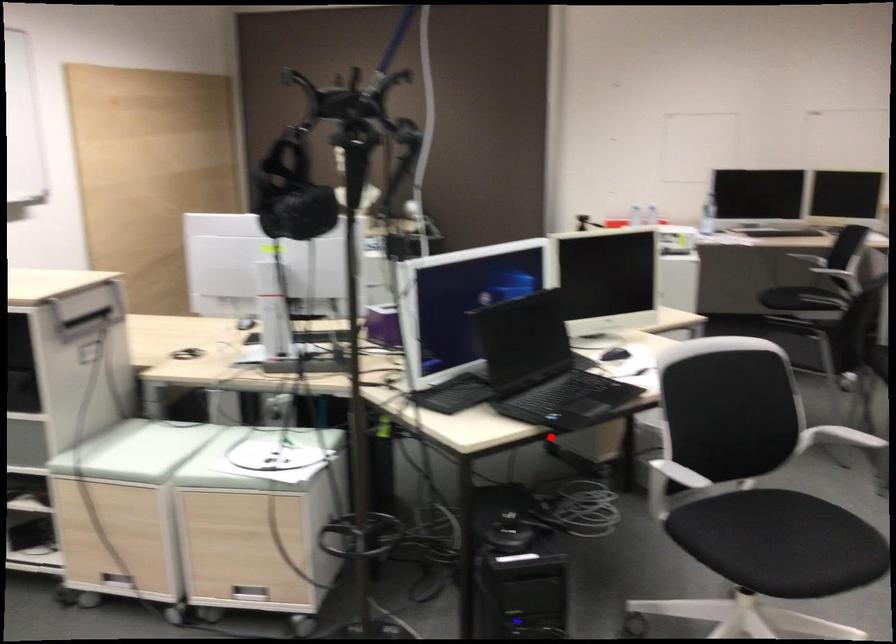
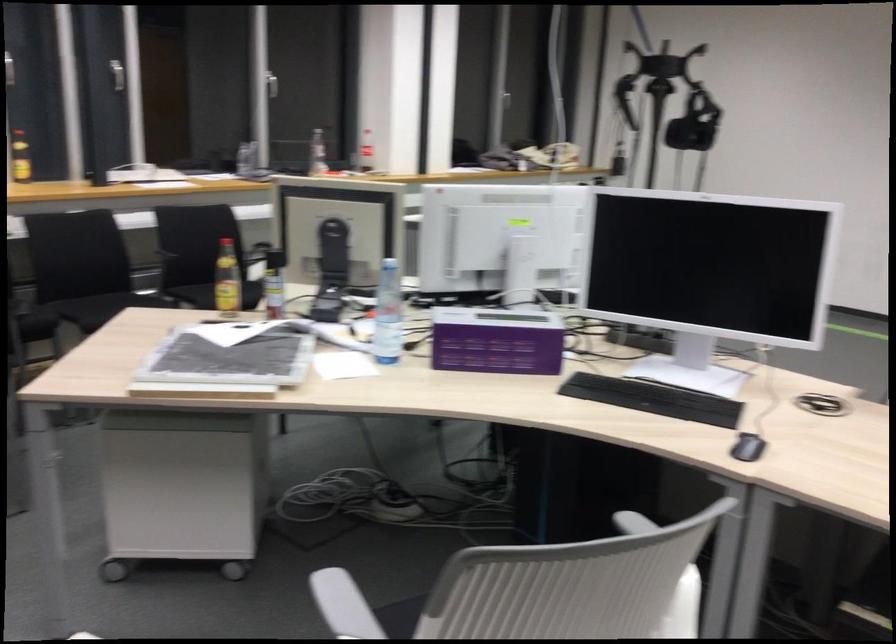
Find the pixel in the second image that matches the highlighted location in the first image.

(234, 569)